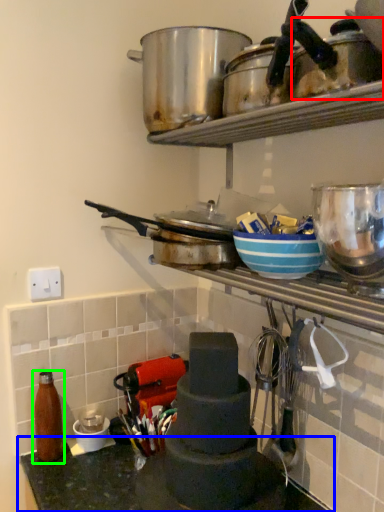
Question: Which is nearer to the appliance (highlighted by a red box)? countertop (highlighted by a blue box) or bottle (highlighted by a green box).

Choices:
 (A) countertop
 (B) bottle

Answer: (A)